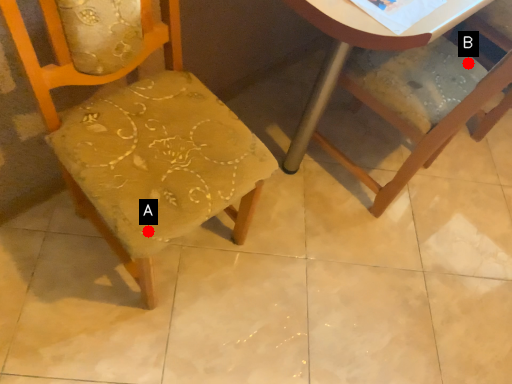
Question: Two points are circled on the image, labeled by A and B beside each circle. Which of the following is the closest to the observer?

Choices:
 (A) A is closer
 (B) B is closer

Answer: (A)